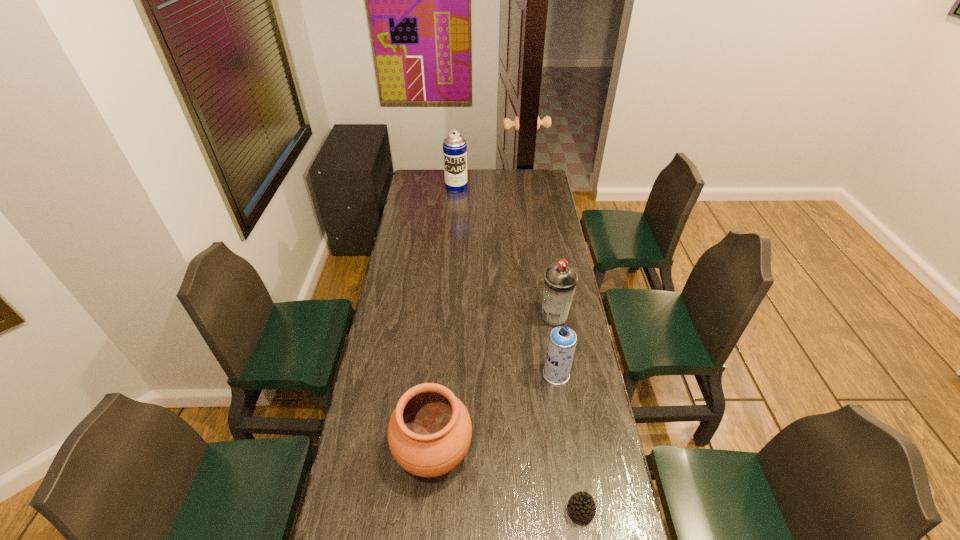
Find the location of `free spot that satisfies the following two spatial constraints: 1. on the back side of the third nearest object; 2. on the left side of the fourth shortest object`. free spot that satisfies the following two spatial constraints: 1. on the back side of the third nearest object; 2. on the left side of the fourth shortest object is located at coordinates (548, 317).

Find the location of `vacant point that satisfies the following two spatial constraints: 1. on the label side of the second tallest aerosol can; 2. on the right side of the leftmost aerosol can`. vacant point that satisfies the following two spatial constraints: 1. on the label side of the second tallest aerosol can; 2. on the right side of the leftmost aerosol can is located at coordinates (446, 317).